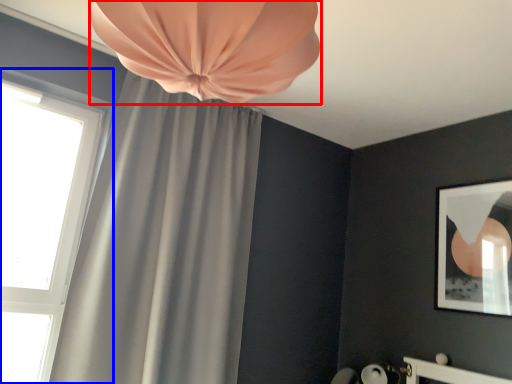
Question: Among these objects, which one is farthest to the camera, curtain (highlighted by a red box) or window (highlighted by a blue box)?

Choices:
 (A) curtain
 (B) window

Answer: (B)